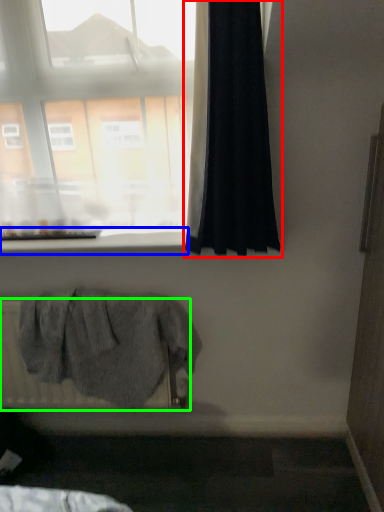
Question: Based on their relative distances, which object is farther from curtain (highlighted by a red box)? Choose from window sill (highlighted by a blue box) and radiator (highlighted by a green box).

Choices:
 (A) window sill
 (B) radiator

Answer: (B)